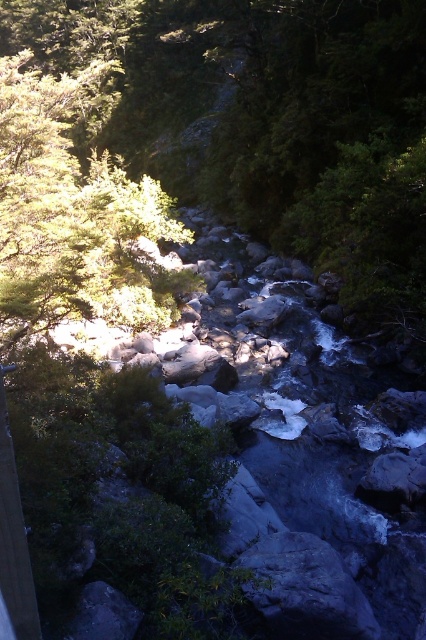
You are an explorer trying to cross the stream. You see the green matte tree at upper left and the gray rock at center. Which object is wider?

The green matte tree at upper left is wider than the gray rock at center.

You are a hiker trying to cross the stream. You see the green leafy tree at center and the gray rock at center. Which object is wider, and could it provide a stable stepping stone for crossing?

The green leafy tree at center might be wider than the gray rock at center, so it could potentially provide a more stable stepping stone for crossing the stream.